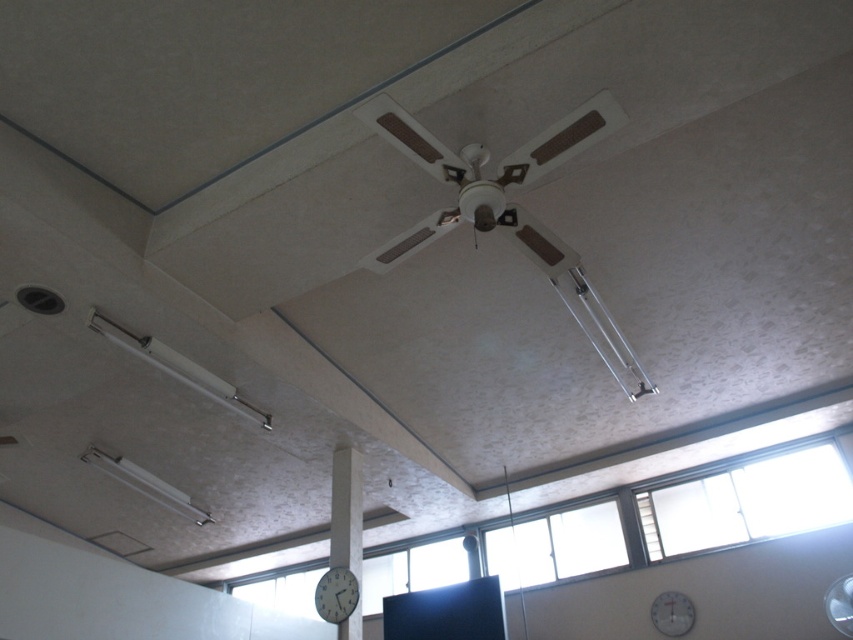
Question: Is white matte ceiling fan at center bigger than white matte clock at center?

Choices:
 (A) yes
 (B) no

Answer: (A)

Question: Is metallic gray clock at lower center thinner than white plastic fan at upper center?

Choices:
 (A) no
 (B) yes

Answer: (A)

Question: Is white concrete clock at center wider than metallic gray clock at lower center?

Choices:
 (A) yes
 (B) no

Answer: (B)

Question: Based on their relative distances, which object is nearer to the white concrete clock at center?

Choices:
 (A) white plastic fan at upper center
 (B) white matte ceiling fan at center

Answer: (B)

Question: Among these objects, which one is nearest to the camera?

Choices:
 (A) metallic gray clock at lower center
 (B) white matte clock at center

Answer: (A)

Question: Which point is farther from the camera taking this photo?

Choices:
 (A) (541, 228)
 (B) (846, 612)
 (C) (347, 563)

Answer: (C)